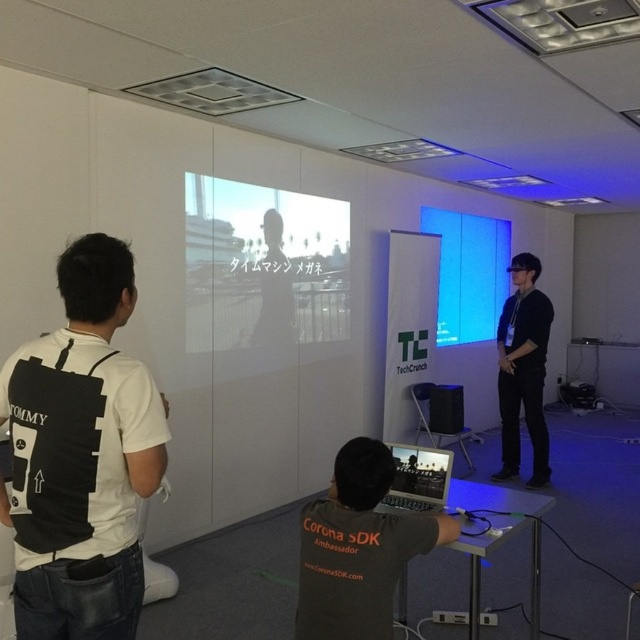
Question: Which point appears farthest from the camera in this image?

Choices:
 (A) (413, 445)
 (B) (124, 593)

Answer: (A)

Question: Can you confirm if black fabric backpack at left is smaller than black plastic projector at center?

Choices:
 (A) yes
 (B) no

Answer: (B)

Question: Observing the image, what is the correct spatial positioning of black fabric backpack at left in reference to black matte shirt at center?

Choices:
 (A) above
 (B) below

Answer: (A)

Question: Is black fabric backpack at left to the left of transparent glass at center from the viewer's perspective?

Choices:
 (A) no
 (B) yes

Answer: (B)

Question: Which object is the farthest from the silver metallic laptop at center?

Choices:
 (A) black plastic projector at center
 (B) black fabric backpack at left
 (C) black matte vr headset at right

Answer: (A)

Question: Which is farther from the blue glossy projection screen at center?

Choices:
 (A) transparent glass at center
 (B) black matte shirt at center

Answer: (B)